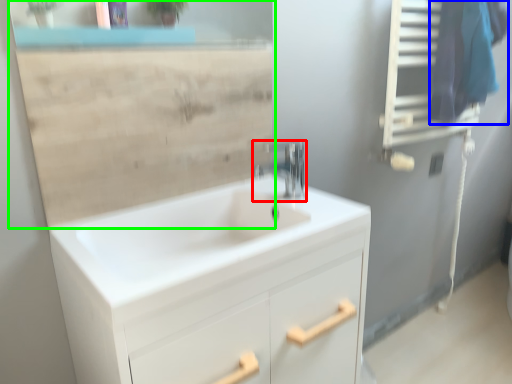
Question: Which object is the farthest from tap (highlighted by a red box)? Choose among these: laundry (highlighted by a blue box) or mirror (highlighted by a green box).

Choices:
 (A) laundry
 (B) mirror

Answer: (A)